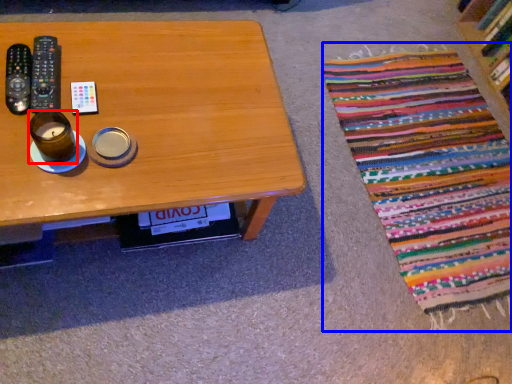
Question: Which point is further to the camera, coffee cup (highlighted by a red box) or blanket (highlighted by a blue box)?

Choices:
 (A) coffee cup
 (B) blanket

Answer: (B)